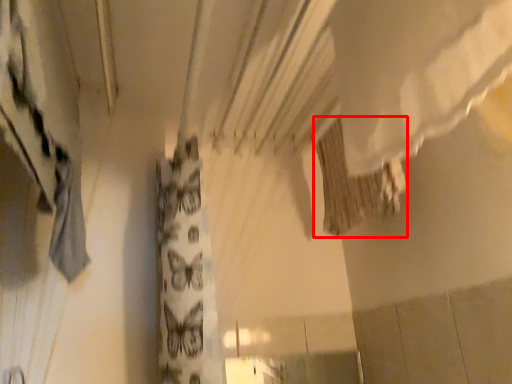
Question: From the image's perspective, where is shower curtain (annotated by the red box) located in relation to curtain in the image?

Choices:
 (A) above
 (B) below

Answer: (B)